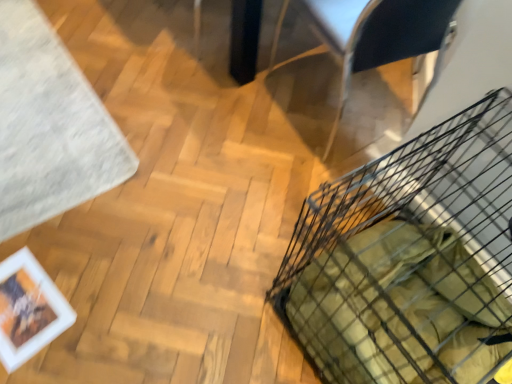
Question: Is black wire basket at lower right to the left or to the right of metallic silver armchair at upper right in the image?

Choices:
 (A) right
 (B) left

Answer: (A)

Question: Based on their sizes in the image, would you say black wire basket at lower right is bigger or smaller than metallic silver armchair at upper right?

Choices:
 (A) big
 (B) small

Answer: (A)

Question: Considering the real-world distances, which object is closest to the white soft rug at upper left?

Choices:
 (A) metallic silver armchair at upper right
 (B) black wire basket at lower right
 (C) white matte picture frame at lower left

Answer: (C)

Question: Estimate the real-world distances between objects in this image. Which object is farther from the white soft rug at upper left?

Choices:
 (A) white matte picture frame at lower left
 (B) metallic silver armchair at upper right
 (C) black wire basket at lower right

Answer: (C)